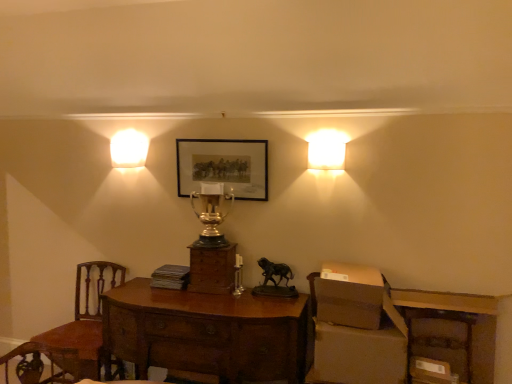
You are a GUI agent. You are given a task and a screenshot of the screen. Output one action in this format:
    pyautogui.click(x=<x>, y=<y>)
    Task: Click on the free space above matte gold trophy at upper center, the 1th lamp positioned from the left (from a real-world perspective)
    This screenshot has width=512, height=384.
    Given the screenshot: What is the action you would take?
    pyautogui.click(x=122, y=142)